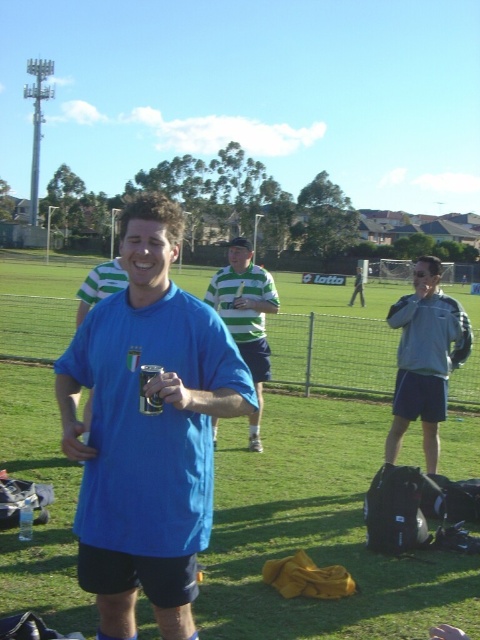
Question: Is green grass at center bigger than blue matte shirt at center?

Choices:
 (A) no
 (B) yes

Answer: (B)

Question: Where is green grass at center located in relation to green striped shirt at center in the image?

Choices:
 (A) left
 (B) right

Answer: (B)

Question: In this image, where is blue matte shirt at center located relative to gray fleece jacket at right?

Choices:
 (A) below
 (B) above

Answer: (B)

Question: Based on their relative distances, which object is nearer to the gray fleece jacket at right?

Choices:
 (A) blue matte shirt at center
 (B) green grass at center
 (C) green striped polo shirt at center
 (D) green striped shirt at center

Answer: (D)

Question: Estimate the real-world distances between objects in this image. Which object is closer to the green grass at center?

Choices:
 (A) green striped shirt at center
 (B) blue matte shirt at center

Answer: (B)

Question: Which point is closer to the camera?

Choices:
 (A) gray fleece jacket at right
 (B) green striped shirt at center
 (C) green grass at center

Answer: (B)